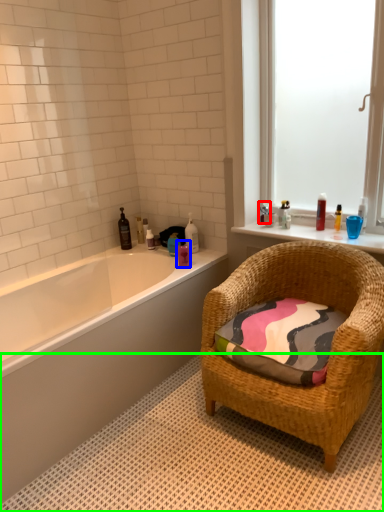
Question: Which is farther away from toiletry (highlighted by a red box)? toiletry (highlighted by a blue box) or bath mat (highlighted by a green box)?

Choices:
 (A) toiletry
 (B) bath mat

Answer: (B)